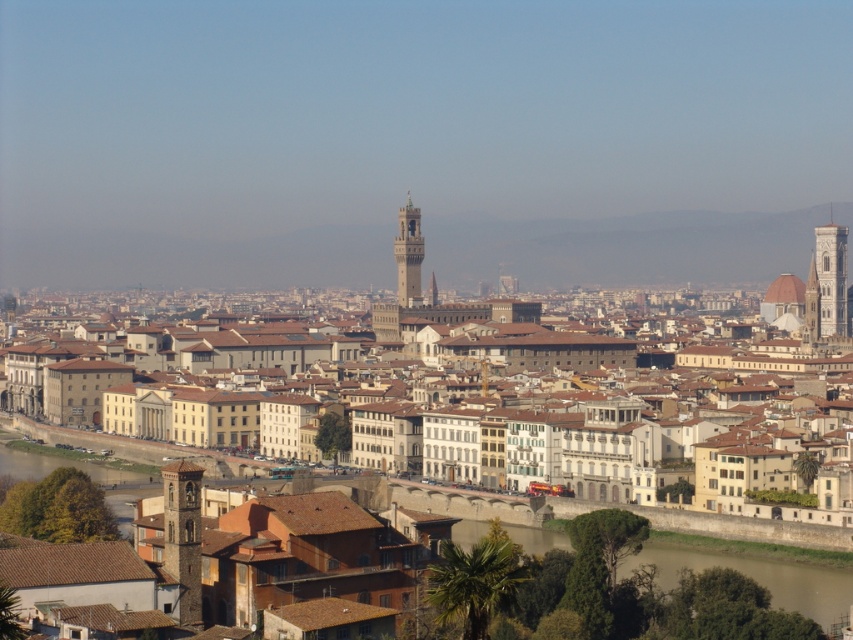
Is stone bell tower at lower left positioned in front of white marble tower at right?

Yes, stone bell tower at lower left is closer to the viewer.

Does stone bell tower at lower left come behind white marble tower at right?

No, it is not.

The width and height of the screenshot is (853, 640). What do you see at coordinates (183, 536) in the screenshot?
I see `stone bell tower at lower left` at bounding box center [183, 536].

I want to click on stone bell tower at lower left, so click(183, 536).

Between point (807, 611) and point (186, 484), which one is positioned in front?

Positioned in front is point (186, 484).

Can you confirm if brown concrete wall at lower center is positioned above stone bell tower at lower left?

No, brown concrete wall at lower center is not above stone bell tower at lower left.

Is point (555, 541) more distant than point (196, 627)?

Yes, it is.

Locate an element on the screen. The width and height of the screenshot is (853, 640). brown concrete wall at lower center is located at coordinates (758, 577).

Does white marble tower at right have a greater height compared to green stone tower at center?

Yes.

Is white marble tower at right thinner than green stone tower at center?

In fact, white marble tower at right might be wider than green stone tower at center.

Is point (827, 288) positioned behind point (416, 268)?

That is False.

Find the location of `white marble tower at right`. white marble tower at right is located at coordinates (831, 276).